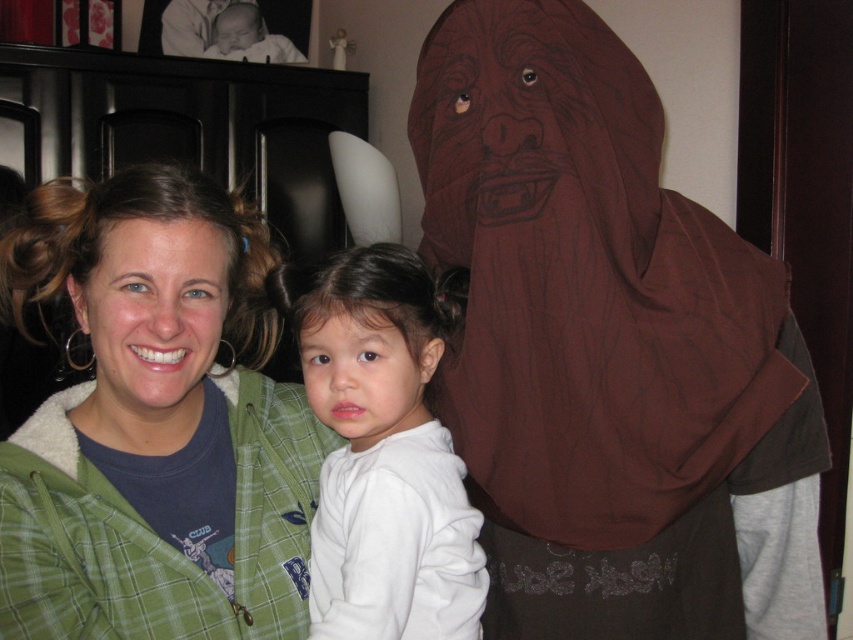
Locate an element on the screen. The width and height of the screenshot is (853, 640). brown fabric mask at right is located at coordinates (608, 349).

Can you confirm if brown fabric mask at right is positioned to the right of white soft sweatshirt at center?

Yes, brown fabric mask at right is to the right of white soft sweatshirt at center.

This screenshot has width=853, height=640. I want to click on brown fabric mask at right, so click(608, 349).

Where is `brown fabric mask at right`? This screenshot has height=640, width=853. brown fabric mask at right is located at coordinates (608, 349).

Is brown fabric mask at right above green plaid jacket at center?

Yes, brown fabric mask at right is above green plaid jacket at center.

Find the location of a particular element. Image resolution: width=853 pixels, height=640 pixels. brown fabric mask at right is located at coordinates (608, 349).

Can you confirm if green plaid jacket at center is shorter than white soft sweatshirt at center?

In fact, green plaid jacket at center may be taller than white soft sweatshirt at center.

Is green plaid jacket at center to the left of white soft sweatshirt at center from the viewer's perspective?

Indeed, green plaid jacket at center is positioned on the left side of white soft sweatshirt at center.

Who is more forward, (67, 225) or (355, 284)?

Point (67, 225) is in front.

The width and height of the screenshot is (853, 640). In order to click on green plaid jacket at center in this screenshot , I will do `click(155, 424)`.